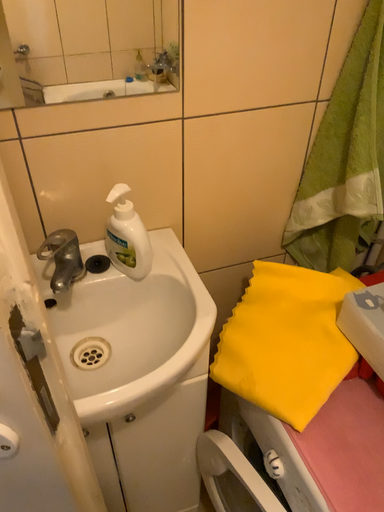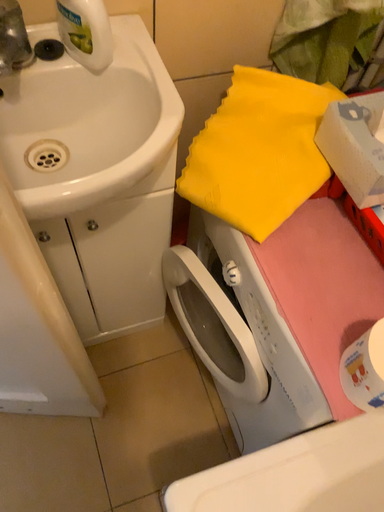
Question: Which way did the camera rotate in the video?

Choices:
 (A) rotated upward
 (B) rotated downward

Answer: (B)